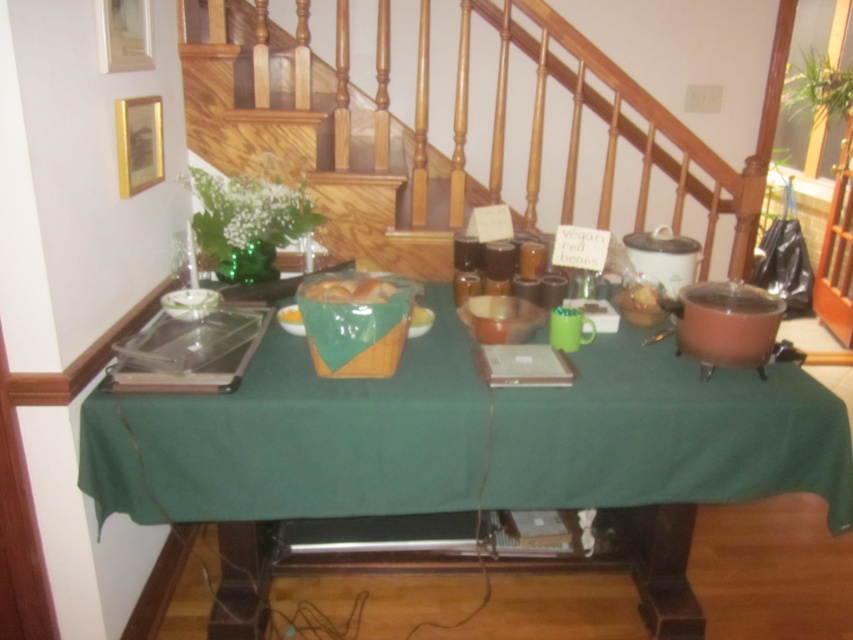
Is matte wooden bread basket at center bigger than yellow matte bread at center?

Indeed, matte wooden bread basket at center has a larger size compared to yellow matte bread at center.

Based on the photo, does matte wooden bread basket at center appear over yellow matte bread at center?

Yes.

Where is `matte wooden bread basket at center`? The height and width of the screenshot is (640, 853). matte wooden bread basket at center is located at coordinates (349, 291).

Is matte wooden bread basket at center bigger than yellow matte bowl at center?

Indeed, matte wooden bread basket at center has a larger size compared to yellow matte bowl at center.

Which is in front, point (352, 294) or point (426, 316)?

Point (352, 294) is more forward.

This screenshot has width=853, height=640. I want to click on matte wooden bread basket at center, so click(x=349, y=291).

Is green fabric table at center further to camera compared to yellow matte bowl at center?

No, green fabric table at center is in front of yellow matte bowl at center.

Which is more to the right, green fabric table at center or yellow matte bowl at center?

green fabric table at center

This screenshot has width=853, height=640. What do you see at coordinates (463, 436) in the screenshot?
I see `green fabric table at center` at bounding box center [463, 436].

The image size is (853, 640). Find the location of `green fabric table at center`. green fabric table at center is located at coordinates (463, 436).